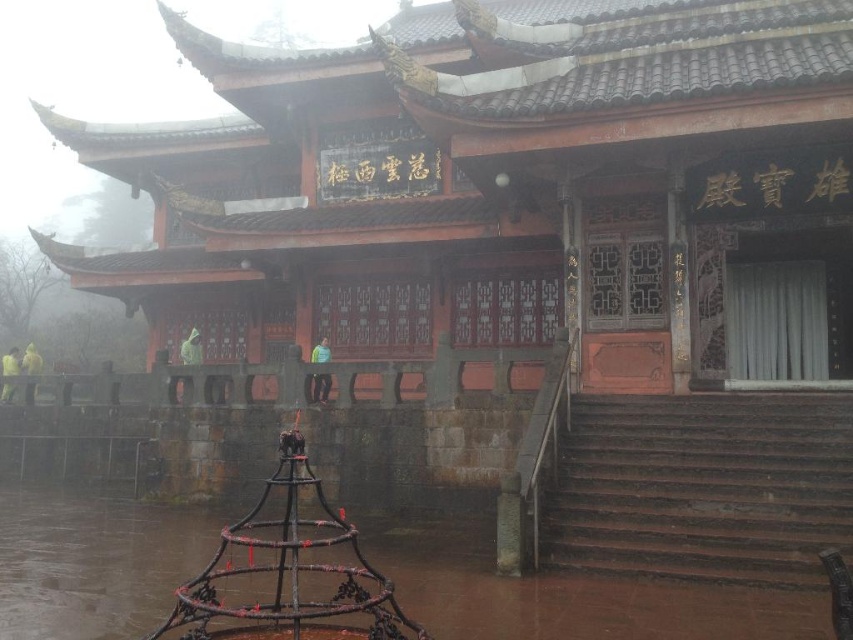
You are standing in front of the traditional Chinese temple structure. You notice a yellow fabric person at left and a yellow matte jacket at left. Which one is positioned higher up?

The yellow fabric person at left is positioned higher up than the yellow matte jacket at left.

From the picture: You are a visitor standing at the base of the brown concrete stairs at lower right wanting to approach the yellow fabric person at left. Based on the scene description, can you walk directly towards the person without needing to climb the stairs first?

The brown concrete stairs at lower right has a lesser width compared to yellow fabric person at left, but the scene does not mention any barriers between them. Therefore, you can walk directly towards the yellow fabric person at left without needing to climb the stairs first.